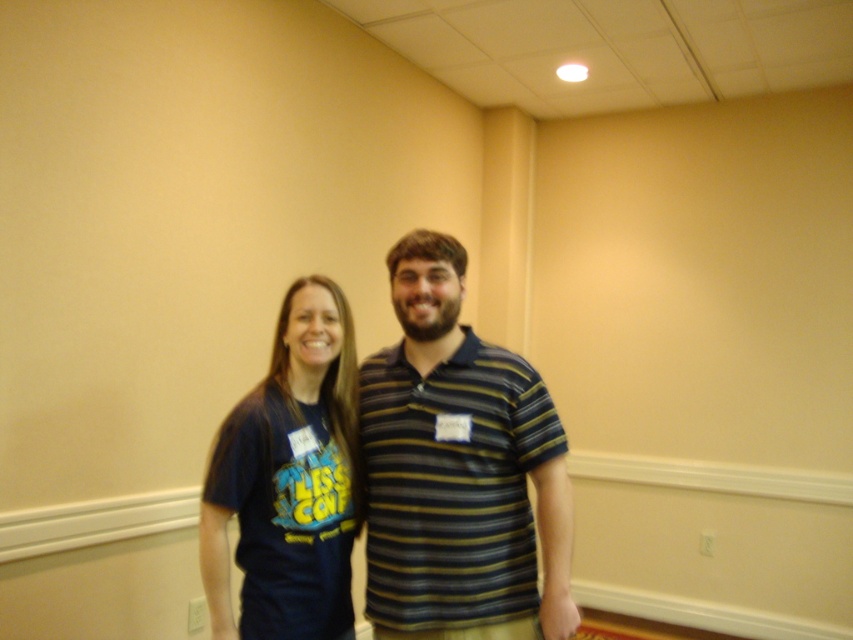
Question: Where is striped polo shirt at center located in relation to dark blue t-shirt at left in the image?

Choices:
 (A) below
 (B) above

Answer: (B)

Question: In this image, where is striped polo shirt at center located relative to dark blue t-shirt at left?

Choices:
 (A) below
 (B) above

Answer: (B)

Question: Can you confirm if striped polo shirt at center is positioned below dark blue t-shirt at left?

Choices:
 (A) yes
 (B) no

Answer: (B)

Question: Which object appears farthest from the camera in this image?

Choices:
 (A) dark blue t-shirt at left
 (B) striped polo shirt at center

Answer: (B)

Question: Which point is closer to the camera taking this photo?

Choices:
 (A) (430, 346)
 (B) (242, 536)

Answer: (B)